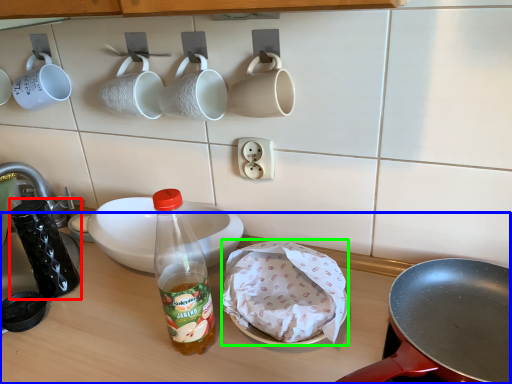
Question: Which object is positioned farthest from tableware (highlighted by a red box)? Select from table top (highlighted by a blue box) and food (highlighted by a green box).

Choices:
 (A) table top
 (B) food

Answer: (B)